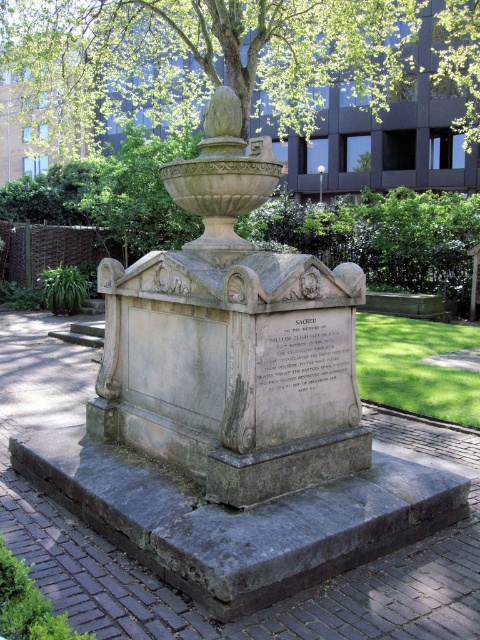
You are standing in front of the monument in the urban park. There are two points marked on the monument. One is at coordinate point (359,280) and the other is at point (446,72). Which point is closer to you when facing the monument?

Point (359,280) is in front of point (446,72), so when facing the monument, point (359,280) is closer to you.

From the picture: You are standing in the park and want to take a photo of the stone monument at center and the green leafy tree at upper center together in the frame. Which object should you focus on first to ensure both are in the photo?

You should focus on the stone monument at center first because it is smaller than the green leafy tree at upper center, so you can adjust the camera to include both by centering the monument and framing the larger tree around it.